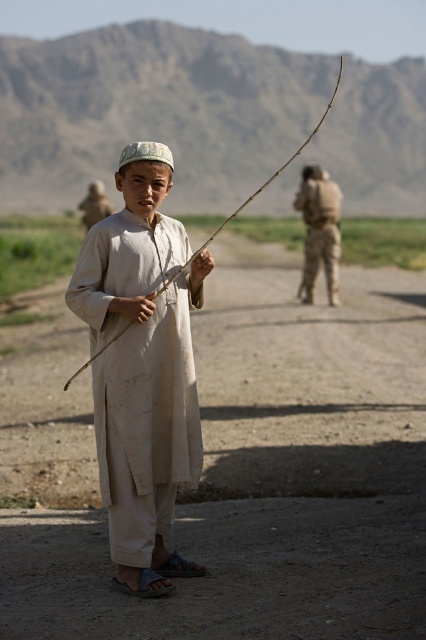
You are a photographer trying to capture the camouflage fabric uniform at right and the smooth wooden stick at center in the same frame. Which object should you focus on first to ensure both are in focus?

You should focus on the camouflage fabric uniform at right first because it is closer to you than the smooth wooden stick at center, so focusing on the closer object will help both be in focus.

You are a photographer trying to capture the boy and the objects in the scene. If you want to frame both the camouflage fabric uniform at right and the smooth wooden stick at center in the same photo, which object should you focus on to ensure both are in the frame?

The camouflage fabric uniform at right has a lesser width compared to smooth wooden stick at center. Therefore, focusing on the camouflage fabric uniform at right would allow both objects to fit within the frame since it is narrower.

You are a tailor who needs to determine which fabric to use for a new order. The customer wants an outfit that is the same size as the beige cotton robe at center. Which object in the image can you use as a reference for the size of the camouflage fabric uniform at right?

The beige cotton robe at center is larger in size than the camouflage fabric uniform at right, so the camouflage fabric uniform at right is smaller. Therefore, the beige cotton robe at center cannot be used as a reference for the size of the camouflage fabric uniform at right. You need to find another reference for the smaller size.